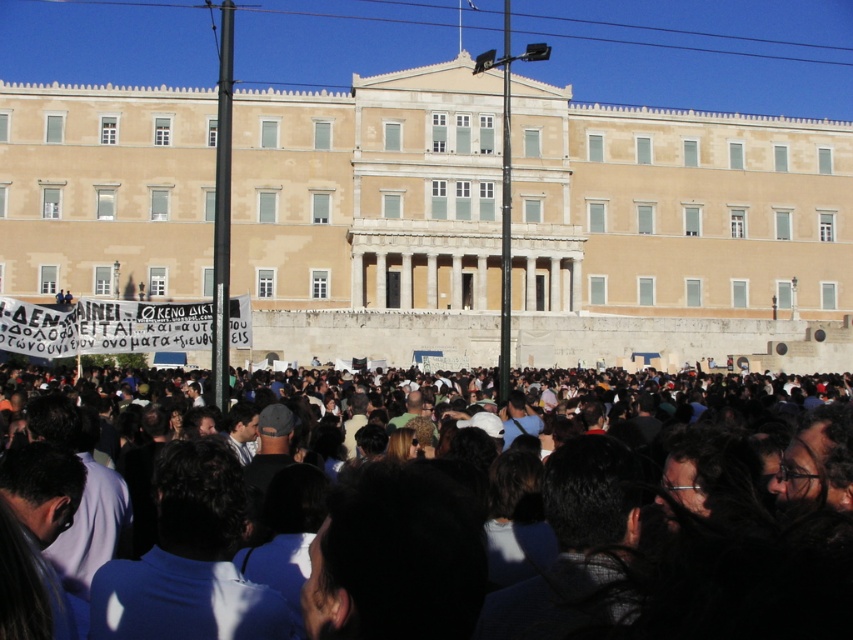
Question: Is beige stone building at center positioned in front of dark brown hair at center?

Choices:
 (A) no
 (B) yes

Answer: (A)

Question: Does beige stone building at center appear on the left side of dark brown hair at center?

Choices:
 (A) no
 (B) yes

Answer: (A)

Question: Which of the following is the farthest from the observer?

Choices:
 (A) dark brown hair at center
 (B) beige stone building at center

Answer: (B)

Question: Is beige stone building at center further to camera compared to dark brown hair at center?

Choices:
 (A) yes
 (B) no

Answer: (A)

Question: Which object appears closest to the camera in this image?

Choices:
 (A) dark brown hair at center
 (B) beige stone building at center

Answer: (A)